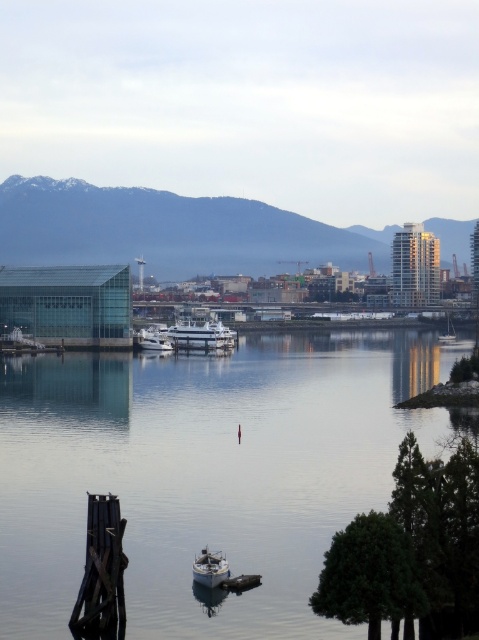
Between dark gray wood dock at lower left and white glossy yacht at center, which one is positioned lower?

Positioned lower is dark gray wood dock at lower left.

This screenshot has width=479, height=640. Find the location of `dark gray wood dock at lower left`. dark gray wood dock at lower left is located at coordinates (102, 573).

What do you see at coordinates (189, 336) in the screenshot?
I see `white glossy yacht at center` at bounding box center [189, 336].

Which is behind, point (209, 344) or point (444, 333)?

Point (444, 333)

This screenshot has width=479, height=640. I want to click on white glossy yacht at center, so click(189, 336).

Does clear water at center come behind white glossy yacht at center?

No, clear water at center is in front of white glossy yacht at center.

Does clear water at center have a greater height compared to white glossy yacht at center?

Yes, clear water at center is taller than white glossy yacht at center.

Between point (27, 365) and point (164, 340), which one is positioned behind?

Point (164, 340)

Locate an element on the screen. This screenshot has height=640, width=479. clear water at center is located at coordinates (205, 472).